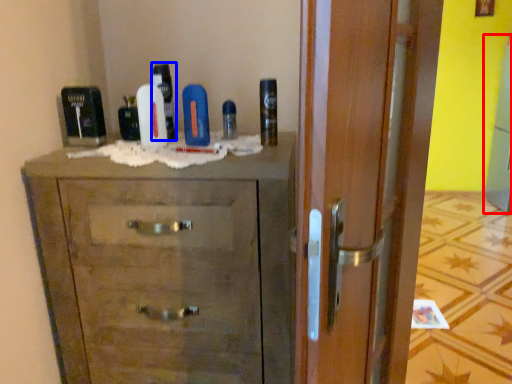
Question: Which object appears farthest to the camera in this image, screen door (highlighted by a red box) or shaving cream (highlighted by a blue box)?

Choices:
 (A) screen door
 (B) shaving cream

Answer: (A)